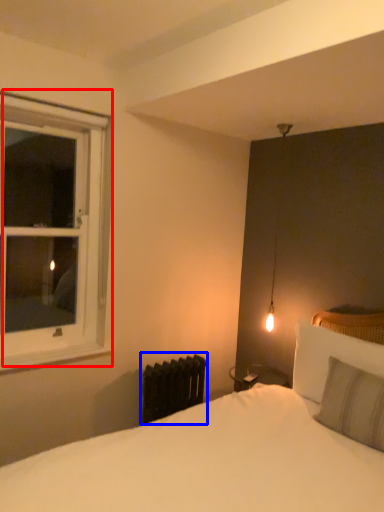
Question: Which object appears closest to the camera in this image, window (highlighted by a red box) or radiator (highlighted by a blue box)?

Choices:
 (A) window
 (B) radiator

Answer: (A)